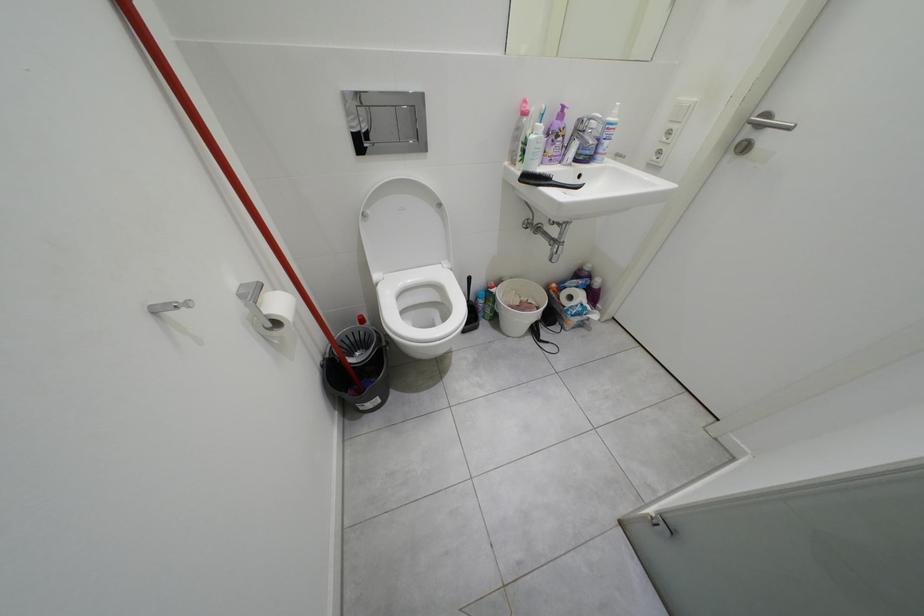
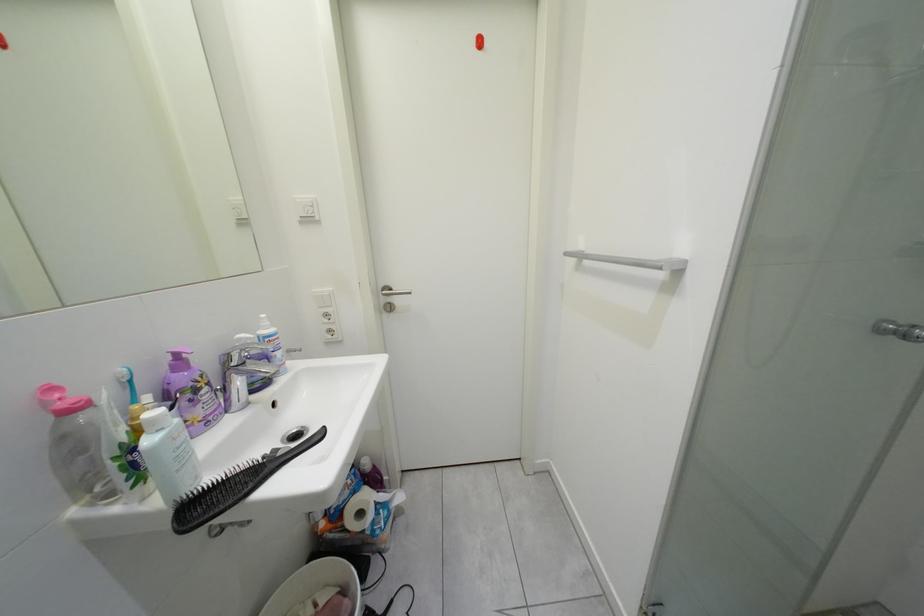
Question: The camera is either moving clockwise (left) or counter-clockwise (right) around the object. The first image is from the beginning of the video and the second image is from the end. Is the camera moving left or right when shooting the video?

Choices:
 (A) Left
 (B) Right

Answer: (A)